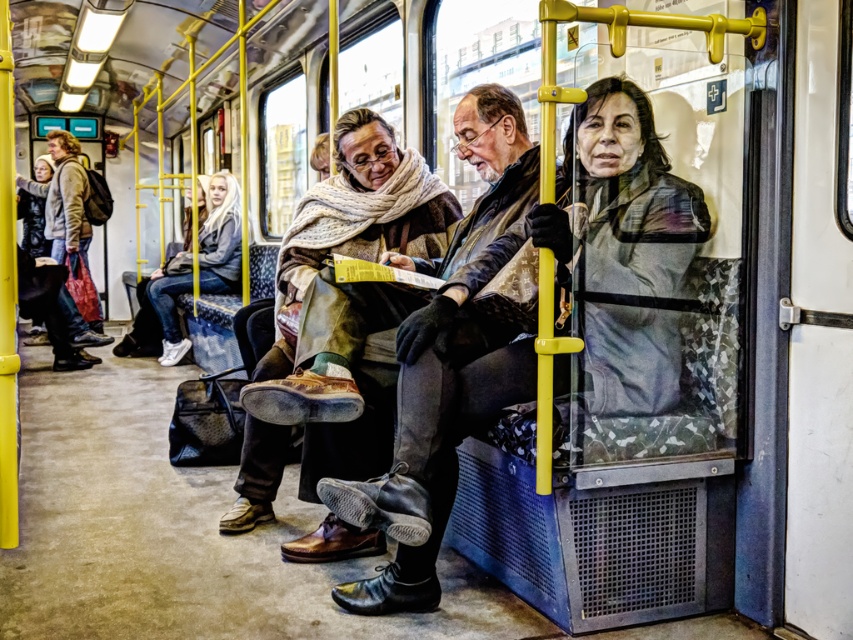
Can you confirm if leather jacket at center is positioned to the left of white denim jeans at left?

No, leather jacket at center is not to the left of white denim jeans at left.

Between leather jacket at center and white denim jeans at left, which one has less height?

leather jacket at center

Measure the distance between point (512, 138) and camera.

Point (512, 138) is 3.07 meters away from camera.

I want to click on leather jacket at center, so pyautogui.click(x=474, y=232).